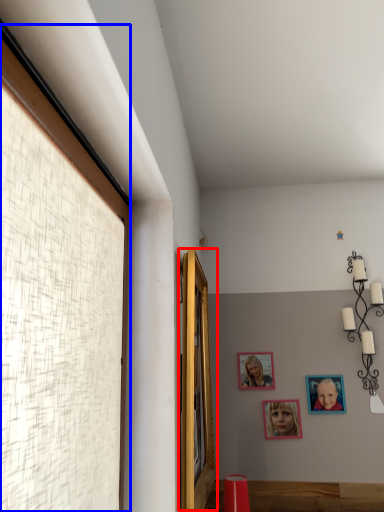
Question: Which point is closer to the camera, window (highlighted by a red box) or window (highlighted by a blue box)?

Choices:
 (A) window
 (B) window

Answer: (B)